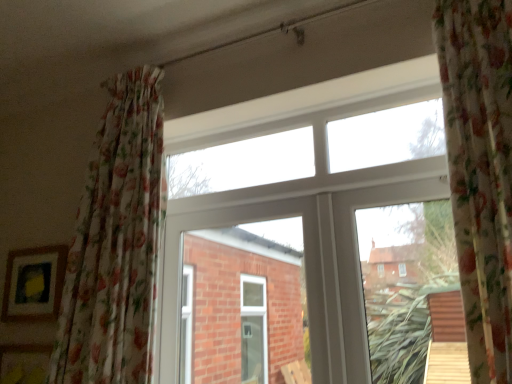
Question: Is white plastic window at center surrounded by floral fabric curtain at left?

Choices:
 (A) no
 (B) yes

Answer: (A)

Question: From the image's perspective, is floral fabric curtain at left on white plastic window at center?

Choices:
 (A) no
 (B) yes

Answer: (B)

Question: From a real-world perspective, is floral fabric curtain at left located higher than white plastic window at center?

Choices:
 (A) no
 (B) yes

Answer: (B)

Question: Can you confirm if floral fabric curtain at left is smaller than white plastic window at center?

Choices:
 (A) yes
 (B) no

Answer: (B)

Question: Does floral fabric curtain at left turn towards white plastic window at center?

Choices:
 (A) no
 (B) yes

Answer: (A)

Question: Is point (98, 150) positioned closer to the camera than point (48, 261)?

Choices:
 (A) farther
 (B) closer

Answer: (B)

Question: In the image, is floral fabric curtain at left positioned in front of or behind matte wooden picture frame at lower left?

Choices:
 (A) front
 (B) behind

Answer: (A)

Question: Considering the relative positions of floral fabric curtain at left and matte wooden picture frame at lower left in the image provided, is floral fabric curtain at left to the left or to the right of matte wooden picture frame at lower left?

Choices:
 (A) left
 (B) right

Answer: (B)

Question: Is floral fabric curtain at left wider or thinner than matte wooden picture frame at lower left?

Choices:
 (A) thin
 (B) wide

Answer: (B)

Question: Does point (40, 294) appear closer or farther from the camera than point (81, 379)?

Choices:
 (A) closer
 (B) farther

Answer: (B)

Question: From a real-world perspective, is matte wooden picture frame at lower left physically located above or below floral fabric curtain at left?

Choices:
 (A) above
 (B) below

Answer: (B)

Question: Is matte wooden picture frame at lower left bigger or smaller than floral fabric curtain at left?

Choices:
 (A) big
 (B) small

Answer: (B)

Question: In terms of height, does matte wooden picture frame at lower left look taller or shorter compared to floral fabric curtain at left?

Choices:
 (A) short
 (B) tall

Answer: (A)

Question: In terms of height, does matte wooden picture frame at lower left look taller or shorter compared to white plastic window at center?

Choices:
 (A) tall
 (B) short

Answer: (B)

Question: Considering the positions of matte wooden picture frame at lower left and white plastic window at center in the image, is matte wooden picture frame at lower left bigger or smaller than white plastic window at center?

Choices:
 (A) small
 (B) big

Answer: (A)